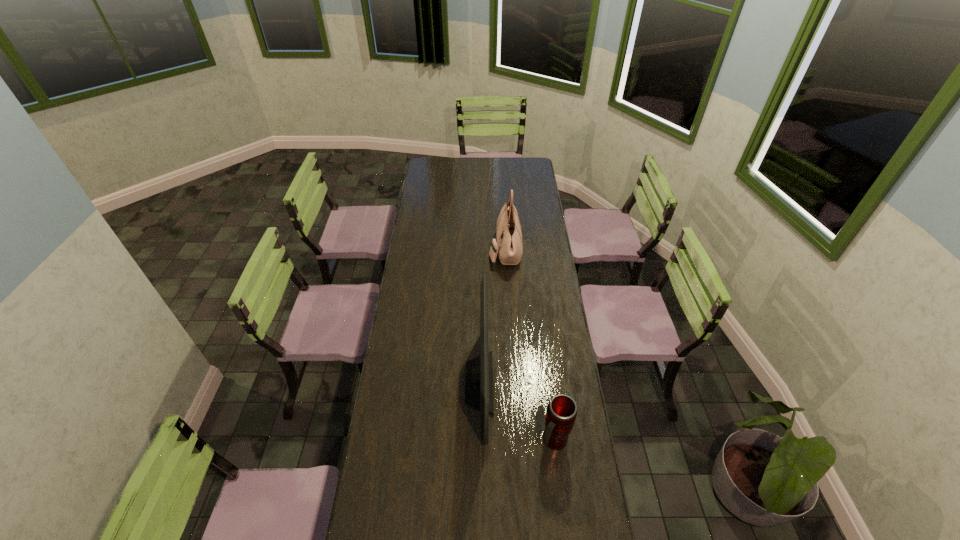
Where is `handbag`? This screenshot has width=960, height=540. handbag is located at coordinates (509, 246).

Image resolution: width=960 pixels, height=540 pixels. In order to click on monitor in this screenshot , I will do `click(479, 371)`.

At what (x,y) coordinates should I click in order to perform the action: click on thermos bottle. Please return your answer as a coordinate pair (x, y). This screenshot has height=540, width=960. Looking at the image, I should click on (561, 414).

You are a GUI agent. You are given a task and a screenshot of the screen. Output one action in this format:
    pyautogui.click(x=<x>, y=<y>)
    Task: Click on the vacant position located 0.320m on the side of the farthest object with the attached pouch
    This screenshot has width=960, height=540.
    Given the screenshot: What is the action you would take?
    pyautogui.click(x=426, y=248)

In order to click on free point located 0.370m on the side of the farthest object with the attached pouch in this screenshot , I will do `click(416, 248)`.

Where is `vacant space located 0.400m on the side of the farthest object with the attached pouch`? The height and width of the screenshot is (540, 960). vacant space located 0.400m on the side of the farthest object with the attached pouch is located at coordinates (410, 248).

Find the location of a particular element. This screenshot has width=960, height=540. vacant space positioned on the screen side of the monitor is located at coordinates (561, 383).

Find the location of a particular element. The height and width of the screenshot is (540, 960). vacant space located on the side with the handle of the shortest object is located at coordinates (561, 496).

Find the location of a particular element. handbag that is at the right edge is located at coordinates (509, 246).

Where is `thermos bottle that is at the right edge`? The height and width of the screenshot is (540, 960). thermos bottle that is at the right edge is located at coordinates (561, 414).